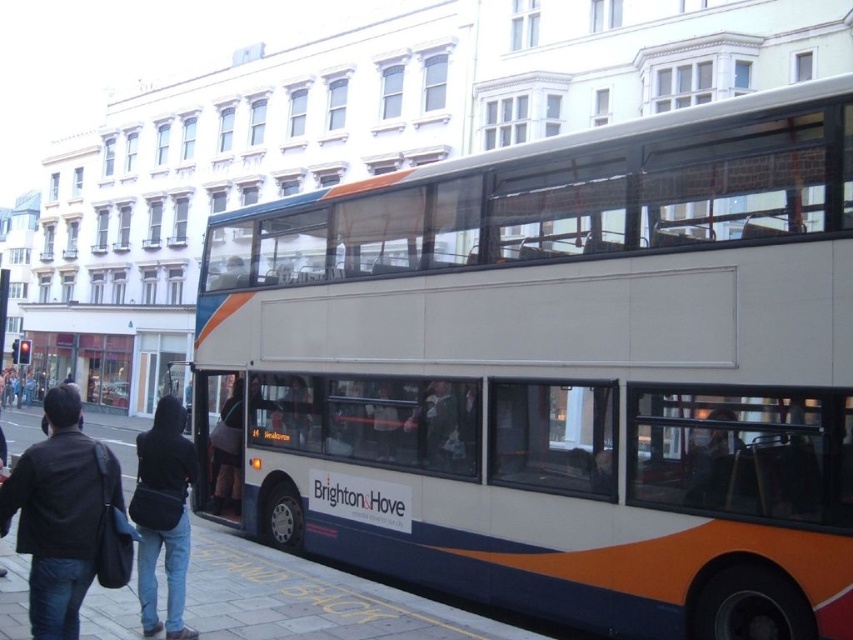
Looking at this image, you are standing at point (189, 477) and want to walk to the bus. Is point (57, 390) between you and the bus?

Yes, point (57, 390) is between you and the bus because it is in front of point (189, 477) where you are standing.

Consider the image. You are a pedestrian standing on the pavement near the yellow markings. You see the white glossy bus at center and the black fabric bag at lower left. Which object is nearer to you?

The white glossy bus at center is closer to the viewer than the black fabric bag at lower left.

You are a tourist standing on the pavement in front of the double decker bus. You see the black leather jacket at lower left and the black fabric bag at lower left. Which one is closer to you?

The black leather jacket at lower left is closer to the viewer than the black fabric bag at lower left.